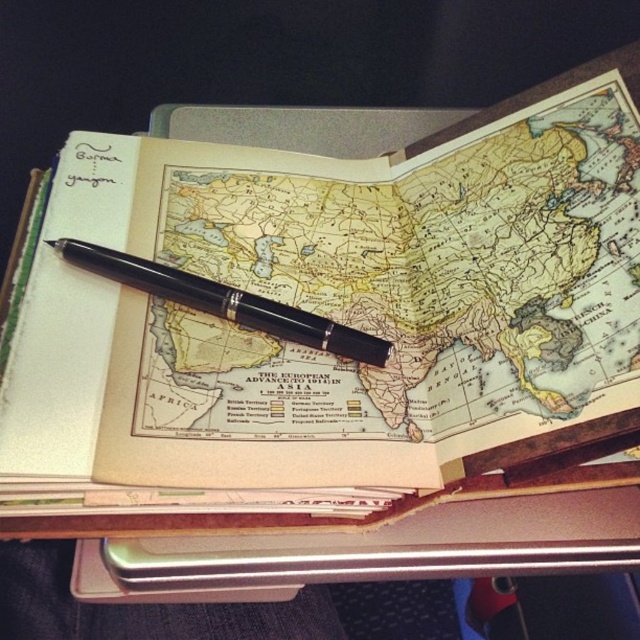
Question: Is matte paper notebook at center to the right of black polished pen at center from the viewer's perspective?

Choices:
 (A) no
 (B) yes

Answer: (B)

Question: Does matte paper notebook at center appear over black polished pen at center?

Choices:
 (A) no
 (B) yes

Answer: (B)

Question: From the image, what is the correct spatial relationship of matte paper notebook at center in relation to black polished pen at center?

Choices:
 (A) right
 (B) left

Answer: (A)